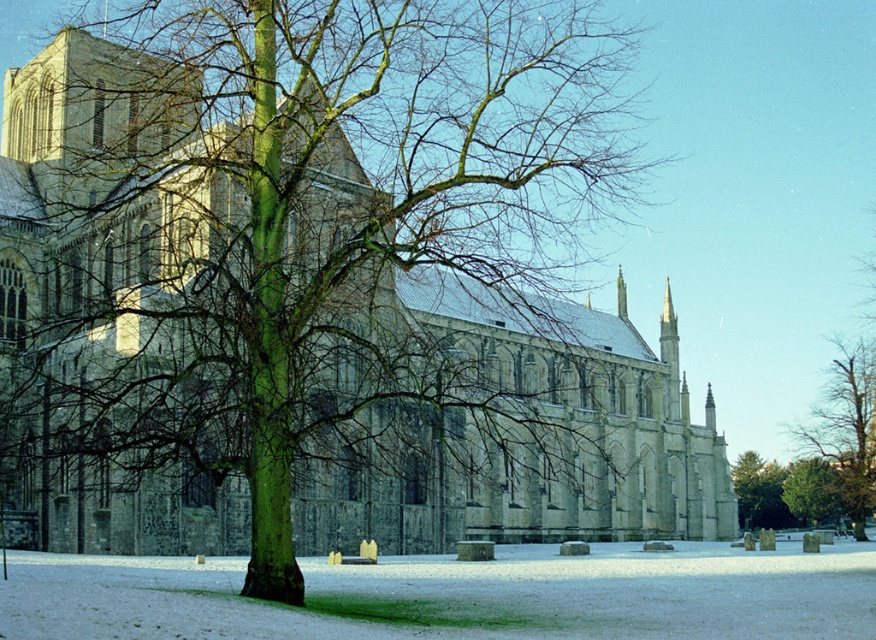
You are standing in a snowy winter landscape and want to take a photo of the stone church at center. If you are exactly 61.50 meters away from it, will you be able to capture the entire structure in one frame without moving closer or farther?

Yes, because the stone church at center is 61.50 meters away from the viewer, which is within a typical camera lens range to capture the entire structure in one frame without needing to adjust your position.

You are an architect visiting the winter scene. You need to determine which structure occupies more space in the image. Based on the scene, which one is bigger between the stone church at center and the green rough bark tree at center?

The stone church at center has a larger size compared to the green rough bark tree at center, so the stone church at center occupies more space in the image.

You are standing in the snow near the green rough bark tree at lower right and want to walk to the stone church at center. In which direction should you head relative to the tree?

You should head to the left relative to the green rough bark tree at lower right because the stone church at center is positioned to the left of the tree.